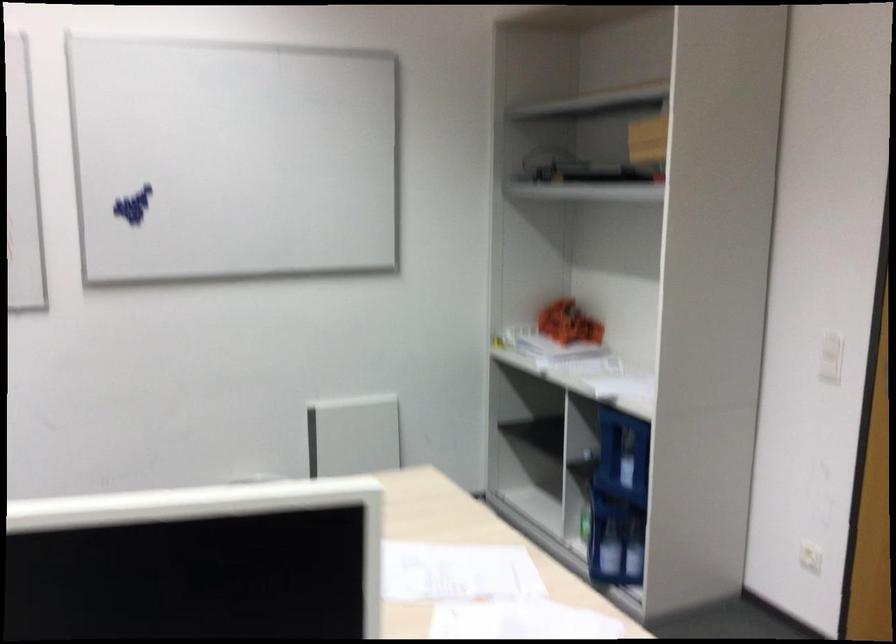
This screenshot has height=644, width=896. I want to click on blue bottle crate, so pos(618,500).